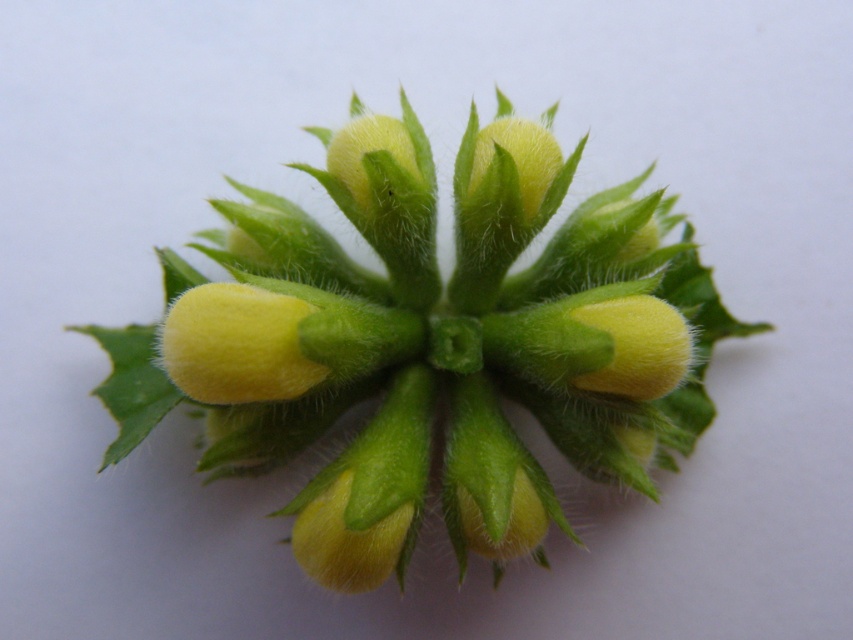
You are a botanist examining a plant through a camera lens. The camera is positioned at a certain distance. You need to determine if the fuzzy yellow buds at center are within the camera lens focus range of 4 feet. Can you confirm?

The fuzzy yellow buds at center are 4.14 feet away from the camera, which is slightly beyond the focus range of 4 feet. Therefore, they may not be in focus.

You are a botanist examining a plant with two central features. You see the fuzzy yellow buds at center and the yellow fuzzy flower at center. Based on their positions, which one is located higher up?

The fuzzy yellow buds at center is located higher up than the yellow fuzzy flower at center.